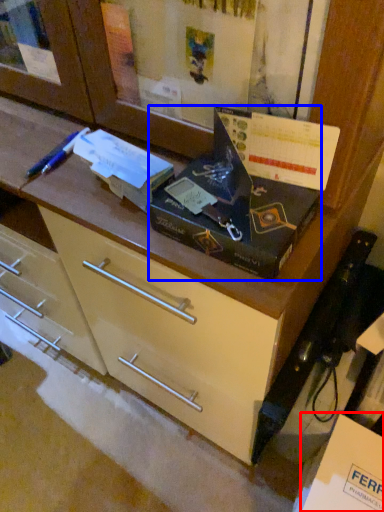
Question: Which point is closer to the camera, cardboard box (highlighted by a red box) or box (highlighted by a blue box)?

Choices:
 (A) cardboard box
 (B) box

Answer: (B)